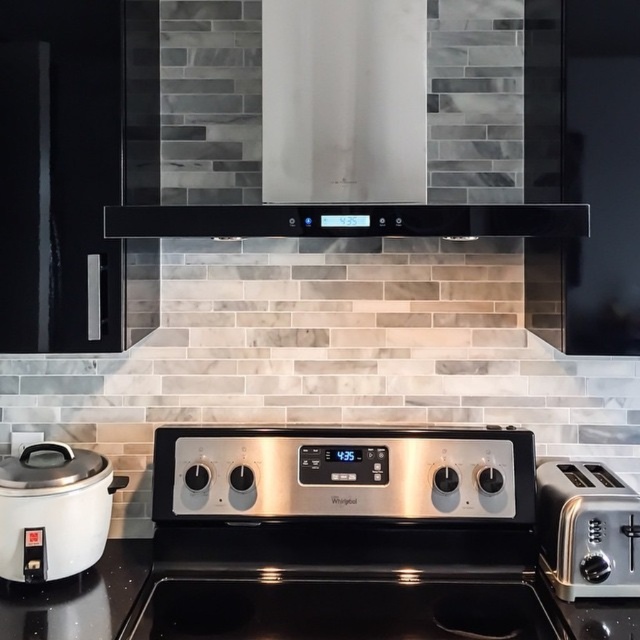
You are preparing breakfast and need to toast bread. You have a satin silver toaster at right and a black glass exhaust hood at upper center. Which appliance is closer to your right side?

The satin silver toaster at right is closer to your right side than the black glass exhaust hood at upper center.

You are a chef preparing to place a 10 inch diameter pot on the black glossy countertop at lower center. The white glossy rice cooker at lower left is already occupying space. Can the pot fit on the countertop without touching the rice cooker?

The distance between the black glossy countertop at lower center and the white glossy rice cooker at lower left is 9.43 inches. Since the pot has a diameter of 10 inches, which is slightly larger than the distance between them, the pot cannot fit without touching the rice cooker.

You are a kitchen designer planning to install a new appliance between the black glossy countertop at lower center and the black glass exhaust hood at upper center. Which object should the appliance be placed above?

The appliance should be placed above the black glossy countertop at lower center because it is located below the black glass exhaust hood at upper center.